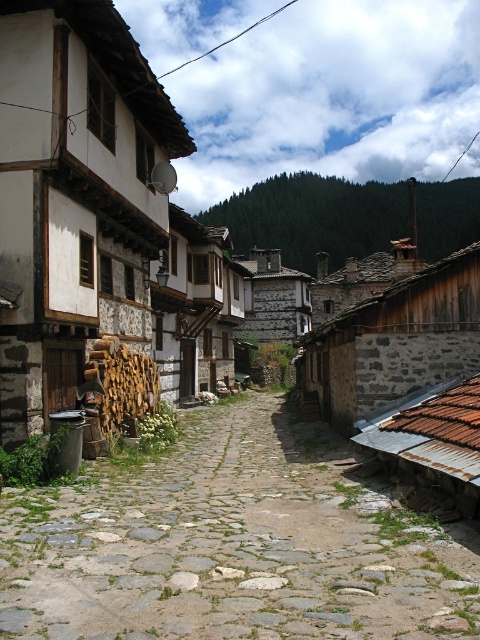
You are standing at the entrance of the village and want to find the rustic stone hut at center. According to the map, where should you look relative to your current position?

The rustic stone hut at center is located at coordinates point (396, 340), so you should look towards the center of the image to find it.

You are standing on the cobblestone street in the village and notice two huts at the center. The rustic stone hut at center and the stone textured hut at center. Which one is directly above the other?

The rustic stone hut at center is positioned under the stone textured hut at center, so the stone textured hut at center is directly above it.